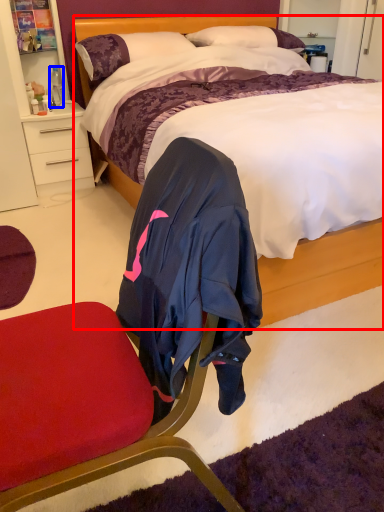
Question: Which object is closer to the camera taking this photo, bed (highlighted by a red box) or bottle (highlighted by a blue box)?

Choices:
 (A) bed
 (B) bottle

Answer: (A)